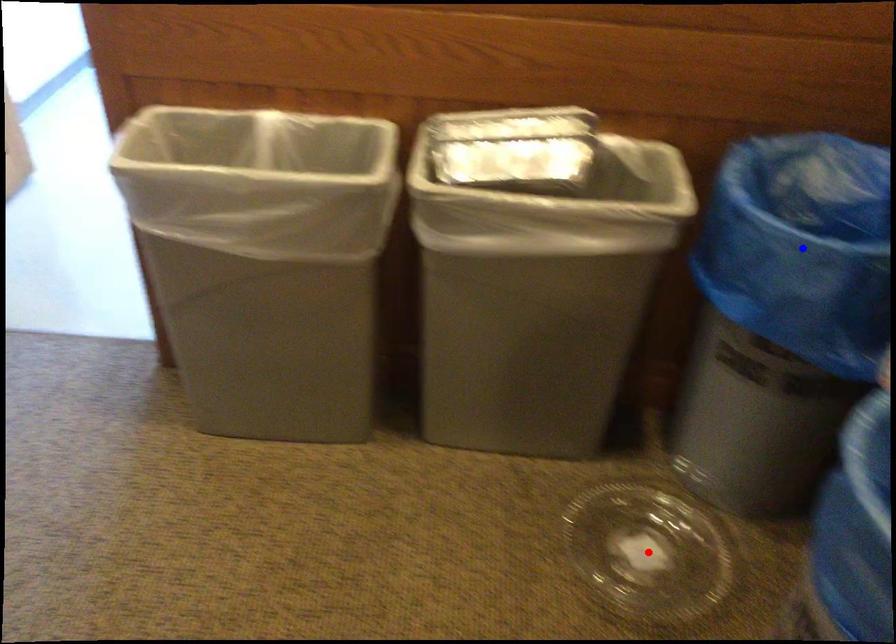
Question: In the image, two points are highlighted. Which point is nearer to the camera? Reply with the corresponding letter.

Choices:
 (A) blue point
 (B) red point

Answer: (A)